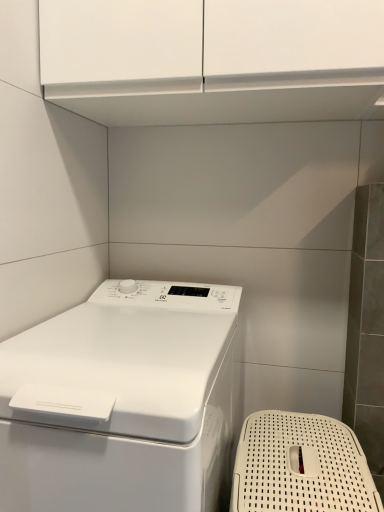
Question: Is the position of white glossy washing machine at lower left more distant than that of white plastic basket at lower right?

Choices:
 (A) yes
 (B) no

Answer: (B)

Question: Considering the relative sizes of white glossy washing machine at lower left and white plastic basket at lower right in the image provided, is white glossy washing machine at lower left thinner than white plastic basket at lower right?

Choices:
 (A) yes
 (B) no

Answer: (B)

Question: Does white glossy washing machine at lower left have a greater width compared to white plastic basket at lower right?

Choices:
 (A) no
 (B) yes

Answer: (B)

Question: Can you confirm if white glossy washing machine at lower left is bigger than white plastic basket at lower right?

Choices:
 (A) yes
 (B) no

Answer: (A)

Question: Are white glossy washing machine at lower left and white plastic basket at lower right making contact?

Choices:
 (A) yes
 (B) no

Answer: (B)

Question: Considering the relative positions of white glossy washing machine at lower left and white plastic basket at lower right in the image provided, is white glossy washing machine at lower left to the left of white plastic basket at lower right from the viewer's perspective?

Choices:
 (A) yes
 (B) no

Answer: (A)

Question: Is white plastic basket at lower right outside of white glossy washing machine at lower left?

Choices:
 (A) yes
 (B) no

Answer: (A)

Question: Is white plastic basket at lower right wider than white glossy washing machine at lower left?

Choices:
 (A) yes
 (B) no

Answer: (B)

Question: From a real-world perspective, is white plastic basket at lower right located beneath white glossy washing machine at lower left?

Choices:
 (A) no
 (B) yes

Answer: (B)

Question: Are white plastic basket at lower right and white glossy washing machine at lower left beside each other?

Choices:
 (A) no
 (B) yes

Answer: (A)

Question: Is white plastic basket at lower right bigger than white glossy washing machine at lower left?

Choices:
 (A) no
 (B) yes

Answer: (A)

Question: From a real-world perspective, is white plastic basket at lower right over white glossy washing machine at lower left?

Choices:
 (A) no
 (B) yes

Answer: (A)

Question: Looking at their shapes, would you say white plastic basket at lower right is wider or thinner than white glossy washing machine at lower left?

Choices:
 (A) wide
 (B) thin

Answer: (B)